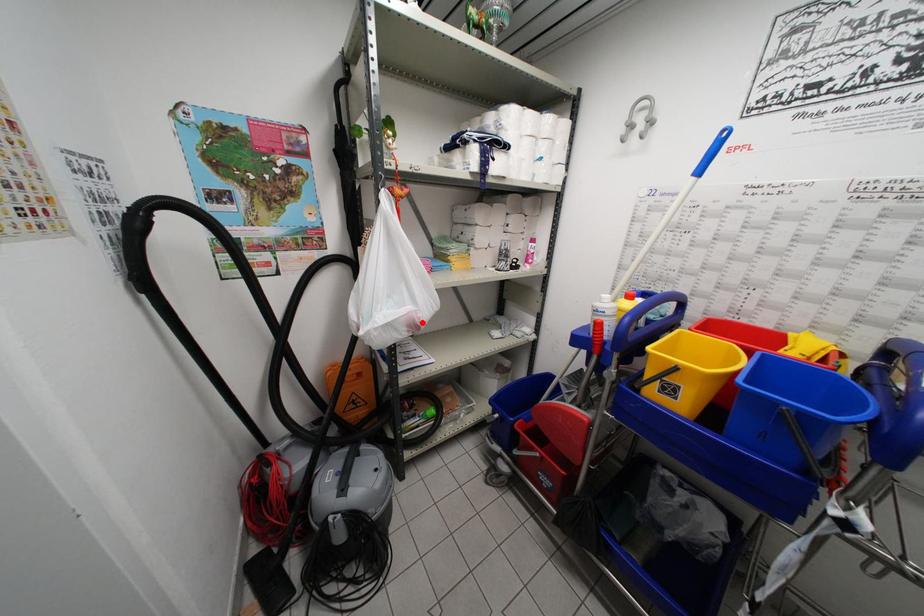
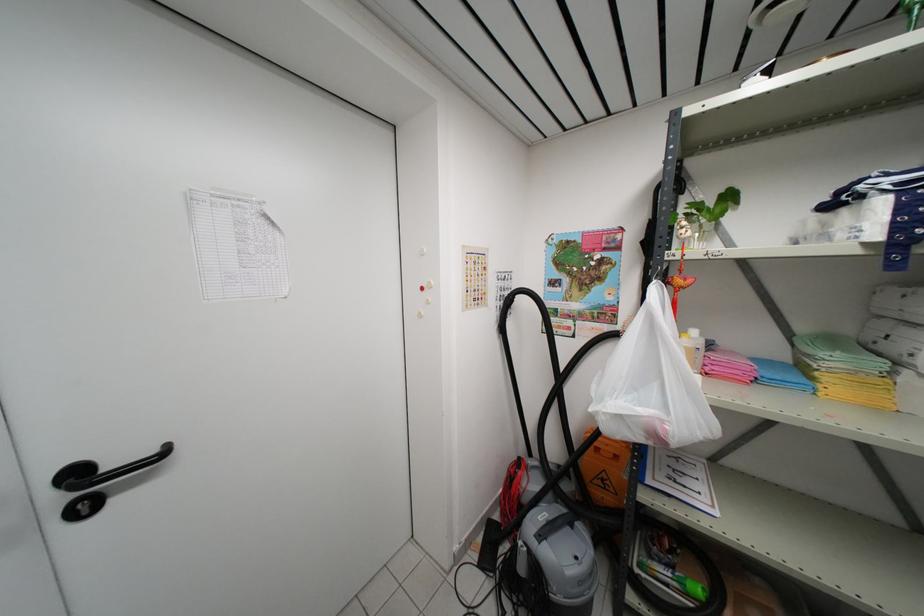
Where in the second image is the point corresponding to the highlighted location from the first image?

(670, 435)